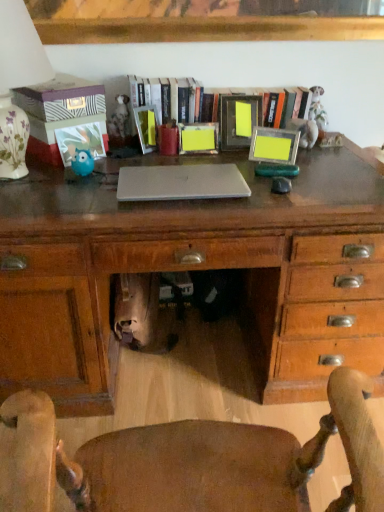
I want to click on free spot in front of matte blue owl at left, which is counted as the 1th toy, starting from the bottom, so click(x=71, y=192).